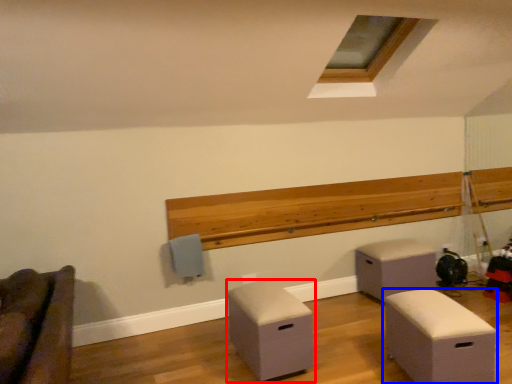
Question: Which point is closer to the camera, furniture (highlighted by a red box) or furniture (highlighted by a blue box)?

Choices:
 (A) furniture
 (B) furniture

Answer: (B)